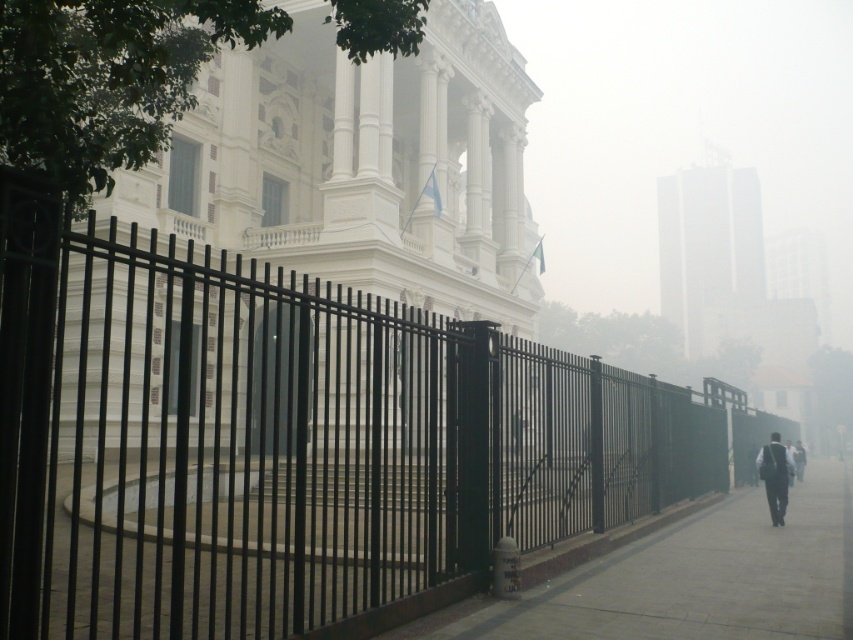
Is black metal fence at center positioned behind smooth concrete pavement at lower right?

That is False.

What do you see at coordinates (286, 438) in the screenshot? I see `black metal fence at center` at bounding box center [286, 438].

In order to click on black metal fence at center in this screenshot , I will do click(286, 438).

Can you confirm if black metal fence at center is wider than dark gray suit at center?

Yes.

Which is above, black metal fence at center or dark gray suit at center?

black metal fence at center is above.

Where is `black metal fence at center`? The height and width of the screenshot is (640, 853). black metal fence at center is located at coordinates (286, 438).

From the picture: Which of these two, smooth concrete pavement at lower right or dark gray suit at center, stands shorter?

Standing shorter between the two is dark gray suit at center.

Between smooth concrete pavement at lower right and dark gray suit at center, which one appears on the left side from the viewer's perspective?

From the viewer's perspective, dark gray suit at center appears more on the left side.

Describe the element at coordinates (692, 579) in the screenshot. The image size is (853, 640). I see `smooth concrete pavement at lower right` at that location.

The image size is (853, 640). I want to click on smooth concrete pavement at lower right, so click(692, 579).